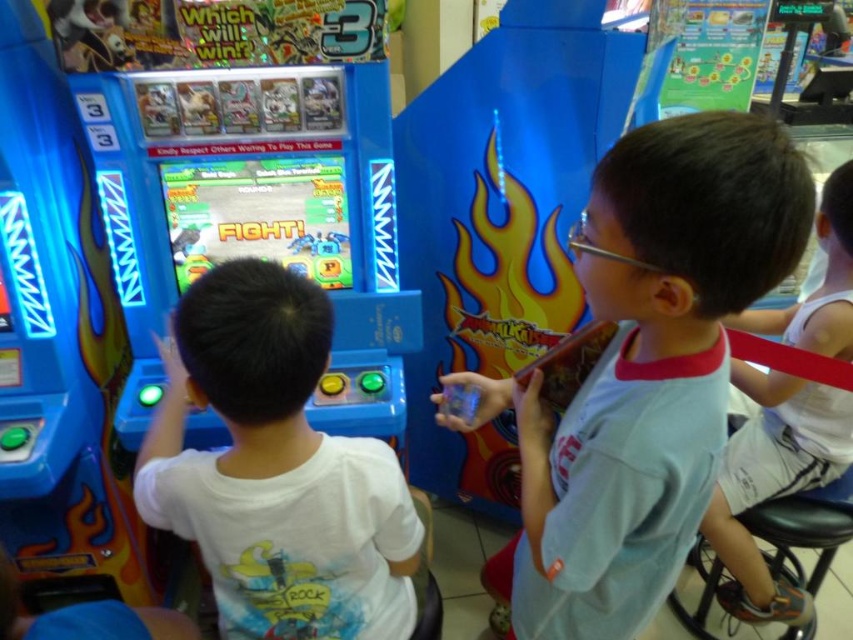
Is point (693, 244) positioned in front of point (819, 476)?

Yes, point (693, 244) is closer to viewer.

How distant is light blue fabric shirt at center from white cotton shirt at right?

The distance of light blue fabric shirt at center from white cotton shirt at right is 28.30 inches.

Does point (616, 173) come closer to viewer compared to point (787, 324)?

Yes, point (616, 173) is in front of point (787, 324).

This screenshot has height=640, width=853. Find the location of `light blue fabric shirt at center`. light blue fabric shirt at center is located at coordinates (646, 365).

Is white cotton shirt at right positioned in front of shiny plastic screen at center?

That is True.

Does white cotton shirt at right appear under shiny plastic screen at center?

Correct, white cotton shirt at right is located below shiny plastic screen at center.

Is point (791, 381) positioned behind point (276, 225)?

No, (791, 381) is in front of (276, 225).

Identify the location of white cotton shirt at right. The height and width of the screenshot is (640, 853). (772, 480).

Is white matte shirt at center taller than shiny plastic screen at center?

Yes.

The image size is (853, 640). What are the coordinates of `white matte shirt at center` in the screenshot? It's located at (276, 468).

Locate an element on the screen. white matte shirt at center is located at coordinates (276, 468).